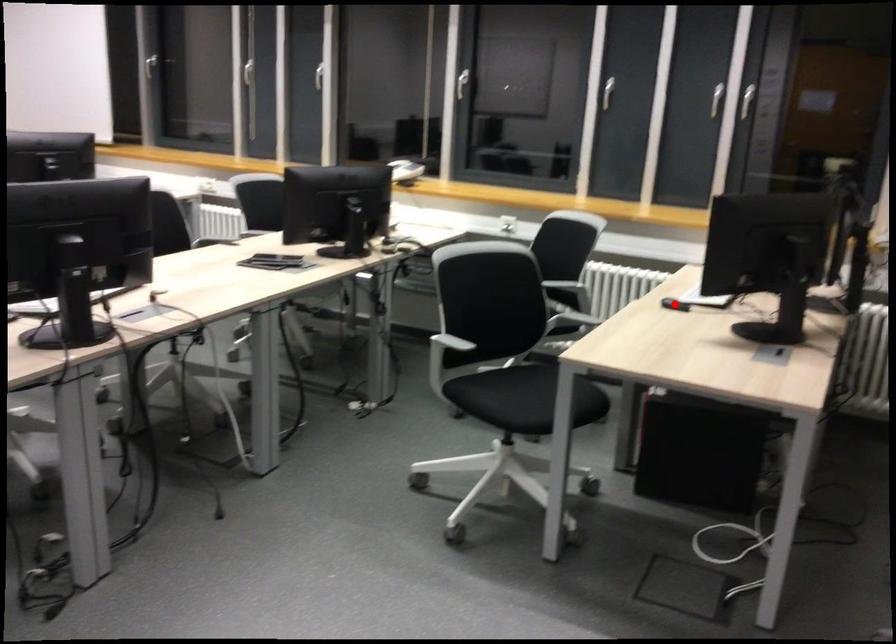
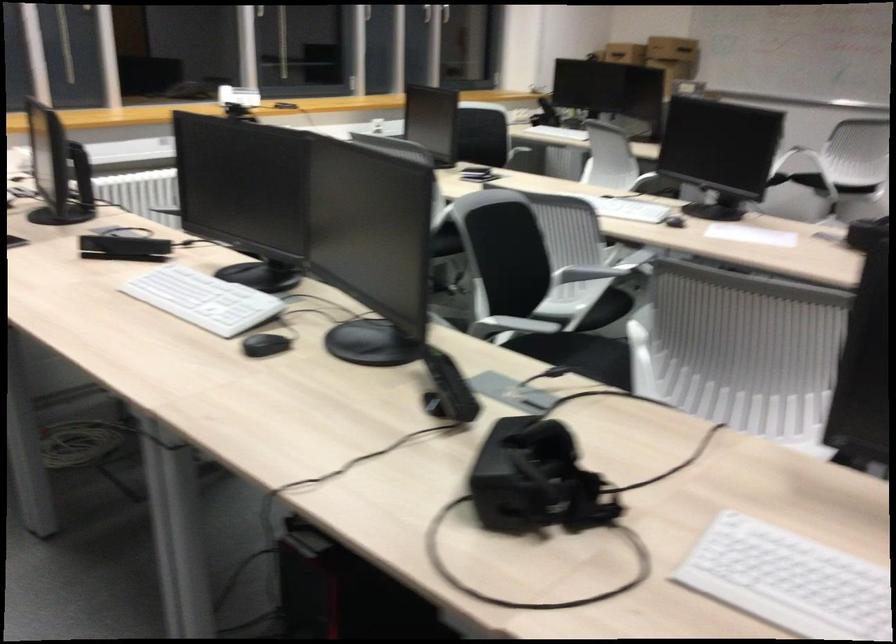
Question: I am providing you with two images of the same scene from different viewpoints. A red point is marked on the first image. At the location where the point appears in image 1, is it still visible in image 2?

Choices:
 (A) Yes
 (B) No

Answer: (B)